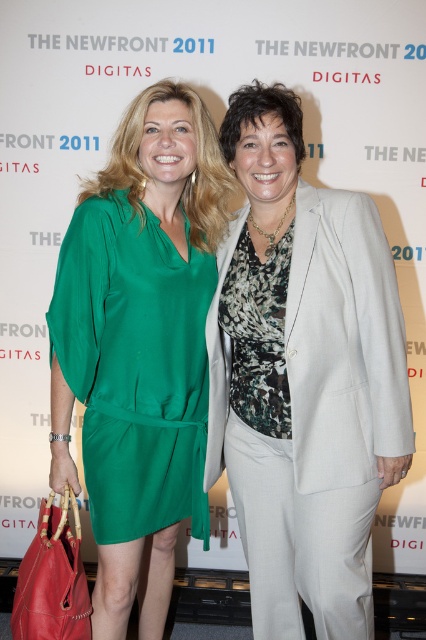
Measure the distance between green silk dress at left and light gray wool business suit at center.

The distance of green silk dress at left from light gray wool business suit at center is 10.32 inches.

Does point (120, 195) come behind point (396, 321)?

Yes, point (120, 195) is behind point (396, 321).

Who is more distant from viewer, (149, 348) or (302, 490)?

Positioned behind is point (149, 348).

Find the location of a particular element. This screenshot has height=640, width=426. green silk dress at left is located at coordinates (135, 365).